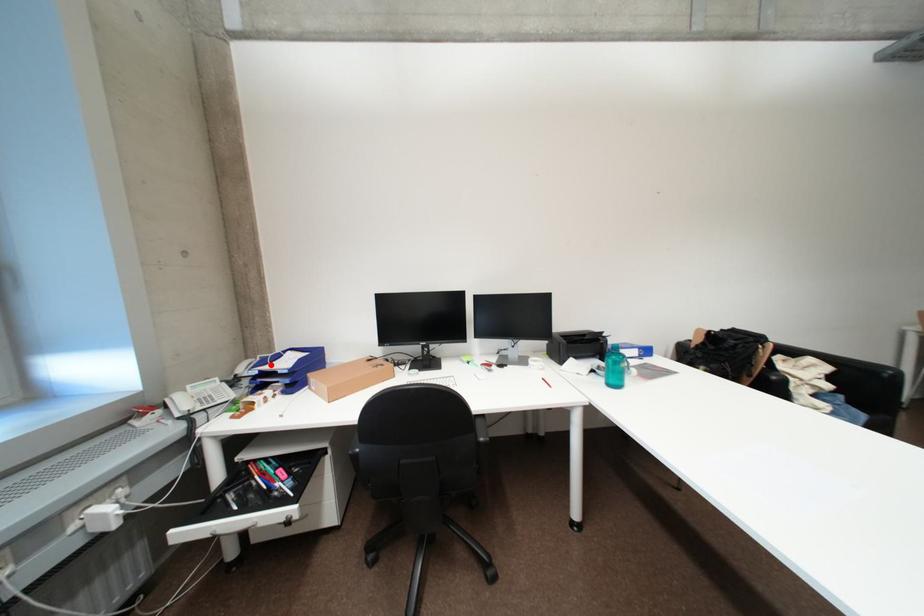
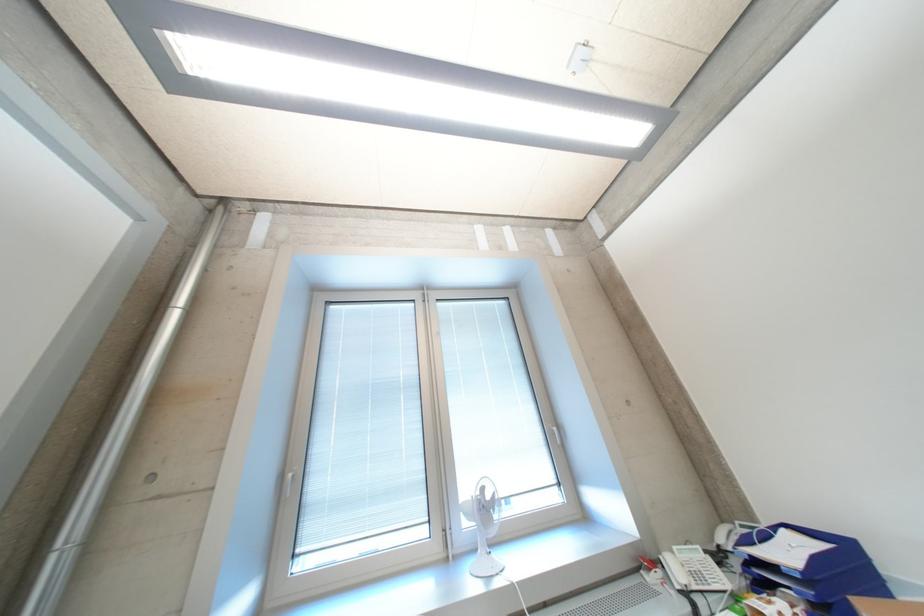
Find the pixel in the second image that matches the highlighted location in the first image.

(757, 543)